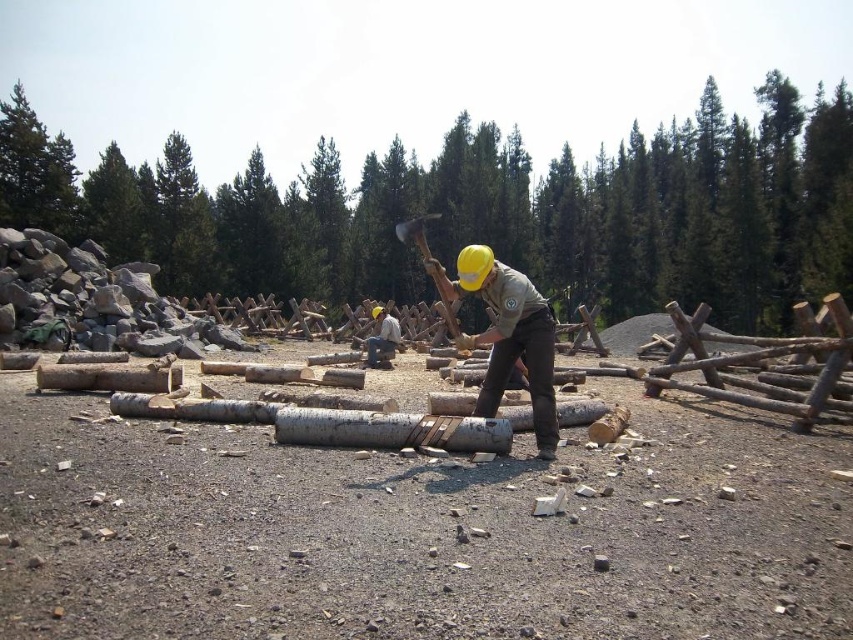
Is smooth wooden logs at center above green rough bark tree at upper left?

Correct, smooth wooden logs at center is located above green rough bark tree at upper left.

Who is more forward, (160, 220) or (19, 90)?

Positioned in front is point (160, 220).

Find the location of a particular element. The image size is (853, 640). smooth wooden logs at center is located at coordinates (485, 211).

Find the location of a particular element. smooth wooden logs at center is located at coordinates (485, 211).

Between smooth wooden logs at center and wooden hatchet at center, which one appears on the right side from the viewer's perspective?

Positioned to the right is wooden hatchet at center.

The height and width of the screenshot is (640, 853). What do you see at coordinates (485, 211) in the screenshot? I see `smooth wooden logs at center` at bounding box center [485, 211].

Locate an element on the screen. The image size is (853, 640). smooth wooden logs at center is located at coordinates (485, 211).

Does green rough bark tree at upper left come in front of wooden hatchet at center?

No, it is not.

Find the location of a particular element. green rough bark tree at upper left is located at coordinates (33, 170).